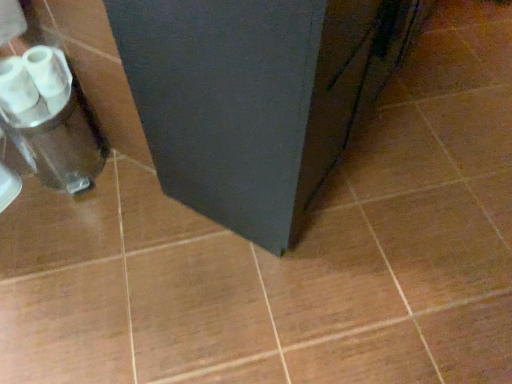
Question: Is white glossy toilet paper at left oriented towards matte black cabinet at center?

Choices:
 (A) no
 (B) yes

Answer: (A)

Question: Could matte black cabinet at center be considered to be inside white glossy toilet paper at left?

Choices:
 (A) yes
 (B) no

Answer: (B)

Question: Is white glossy toilet paper at left turned away from matte black cabinet at center?

Choices:
 (A) no
 (B) yes

Answer: (A)

Question: Is white glossy toilet paper at left further to the viewer compared to matte black cabinet at center?

Choices:
 (A) no
 (B) yes

Answer: (B)

Question: Considering the relative sizes of white glossy toilet paper at left and matte black cabinet at center in the image provided, is white glossy toilet paper at left thinner than matte black cabinet at center?

Choices:
 (A) no
 (B) yes

Answer: (B)

Question: In the image, is white glossy toilet paper at left on the left side or the right side of matte black cabinet at center?

Choices:
 (A) left
 (B) right

Answer: (A)

Question: Is point (11, 97) positioned closer to the camera than point (359, 79)?

Choices:
 (A) farther
 (B) closer

Answer: (A)

Question: Considering the positions of white glossy toilet paper at left and matte black cabinet at center in the image, is white glossy toilet paper at left bigger or smaller than matte black cabinet at center?

Choices:
 (A) small
 (B) big

Answer: (A)

Question: Is white glossy toilet paper at left wider or thinner than matte black cabinet at center?

Choices:
 (A) thin
 (B) wide

Answer: (A)

Question: Is point (39, 96) closer or farther from the camera than point (55, 122)?

Choices:
 (A) closer
 (B) farther

Answer: (A)

Question: From a real-world perspective, is white glossy toilet paper at left physically located above or below silver metallic blender at left?

Choices:
 (A) below
 (B) above

Answer: (B)

Question: Considering the positions of white glossy toilet paper at left and silver metallic blender at left in the image, is white glossy toilet paper at left wider or thinner than silver metallic blender at left?

Choices:
 (A) wide
 (B) thin

Answer: (B)

Question: Considering their positions, is white glossy toilet paper at left located in front of or behind silver metallic blender at left?

Choices:
 (A) front
 (B) behind

Answer: (A)

Question: Considering the positions of point (345, 115) and point (41, 46), is point (345, 115) closer or farther from the camera than point (41, 46)?

Choices:
 (A) farther
 (B) closer

Answer: (B)

Question: In terms of width, does matte black cabinet at center look wider or thinner when compared to white glossy toilet paper at left?

Choices:
 (A) thin
 (B) wide

Answer: (B)